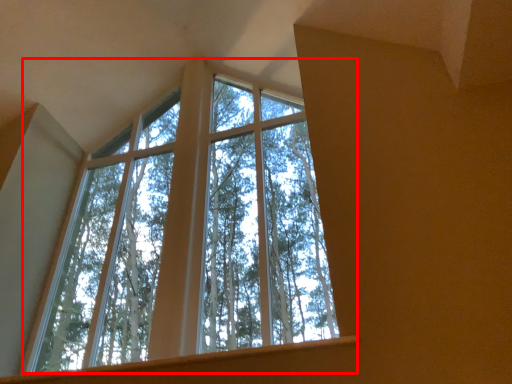
Question: From the image's perspective, what is the correct spatial relationship of window (annotated by the red box) in relation to window sill?

Choices:
 (A) below
 (B) above

Answer: (B)